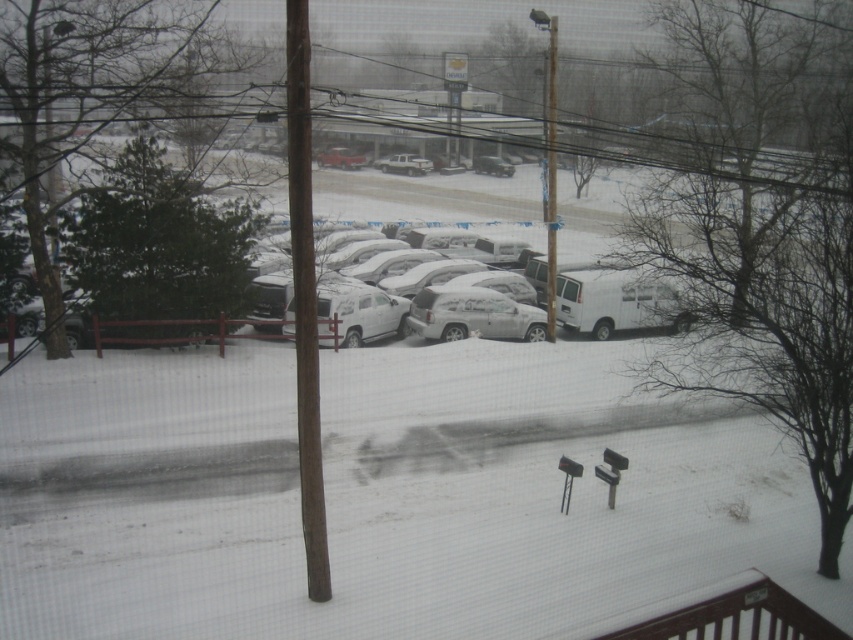
Can you confirm if white matte van at center is smaller than satin silver suv at center?

Yes.

Is point (407, 154) farther from viewer compared to point (490, 161)?

That is True.

The height and width of the screenshot is (640, 853). Find the location of `white matte van at center`. white matte van at center is located at coordinates (405, 164).

Locate an element on the screen. This screenshot has width=853, height=640. white matte van at center is located at coordinates (405, 164).

Is point (308, 276) less distant than point (550, 236)?

Yes, point (308, 276) is closer to viewer.

Is brown wooden pole at center to the right of metallic pole at center from the viewer's perspective?

In fact, brown wooden pole at center is to the left of metallic pole at center.

Is point (315, 316) less distant than point (548, 317)?

Yes, point (315, 316) is closer to viewer.

I want to click on brown wooden pole at center, so click(305, 300).

Is the position of metallic pole at center less distant than that of satin silver suv at center?

Yes, metallic pole at center is closer to the viewer.

Measure the distance between metallic pole at center and satin silver suv at center.

metallic pole at center and satin silver suv at center are 41.05 feet apart from each other.

The image size is (853, 640). I want to click on metallic pole at center, so click(550, 164).